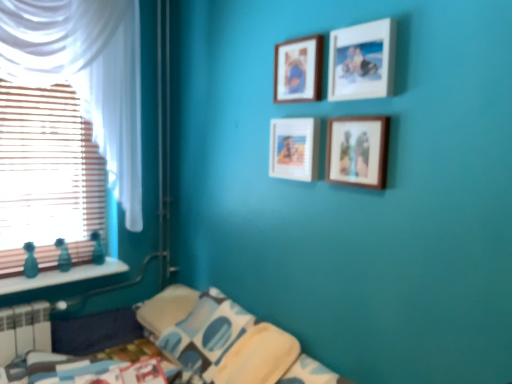
Question: Is point tap(46, 311) positioned closer to the camera than point tap(105, 64)?

Choices:
 (A) closer
 (B) farther

Answer: (B)

Question: Is white plastic radiator at lower left situated inside white sheer curtain at left or outside?

Choices:
 (A) inside
 (B) outside

Answer: (B)

Question: Estimate the real-world distances between objects in this image. Which object is farther from the white sheer curtain at left?

Choices:
 (A) wooden picture frame at upper center, the second picture frame viewed from the top
 (B) wooden picture frame at upper center, placed as the 4th picture frame when sorted from bottom to top
 (C) wooden blinds at left
 (D) white plastic radiator at lower left
 (E) blue printed fabric pillow at lower center

Answer: (A)

Question: Which of these objects is positioned farthest from the white sheer curtain at left?

Choices:
 (A) teal glass bottles at left
 (B) wooden frame at center, which is counted as the 4th picture frame, starting from the top
 (C) matte wooden picture frame at center, which is the 2th picture frame in bottom-to-top order
 (D) white plastic radiator at lower left
 (E) wooden blinds at left

Answer: (B)